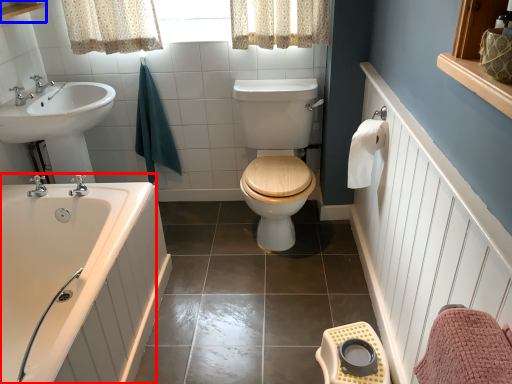
Question: Which point is closer to the camera, bathtub (highlighted by a red box) or balustrade (highlighted by a blue box)?

Choices:
 (A) bathtub
 (B) balustrade

Answer: (A)